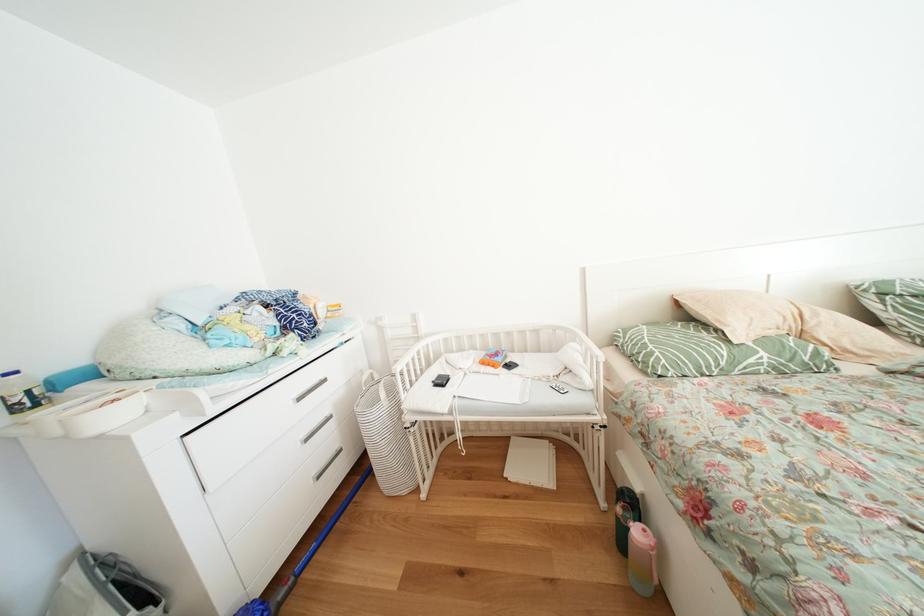
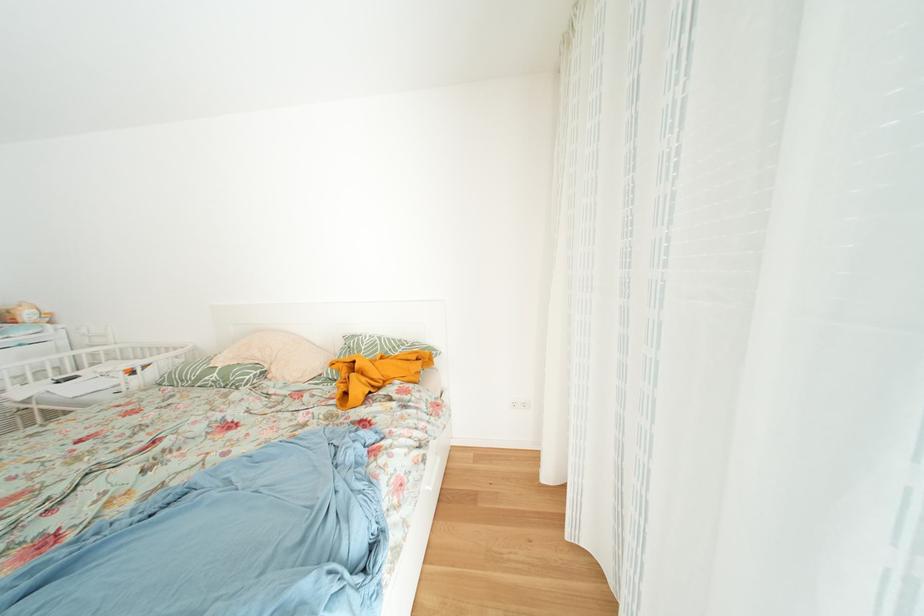
Question: What movement of the cameraman would produce the second image?

Choices:
 (A) Left
 (B) Right
 (C) Forward
 (D) Backward

Answer: (B)